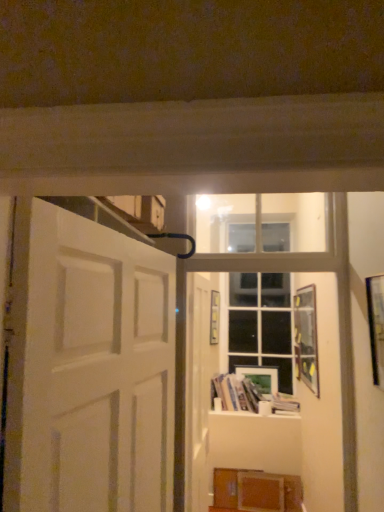
Locate an element on the screen. This screenshot has width=384, height=512. white glossy bookshelf at center, the 2th book in the right-to-left sequence is located at coordinates (246, 395).

Identify the location of white matte door at left, the 1th door when ordered from front to back. (97, 369).

Measure the distance between metallic silver picture frame at right, which ranks as the 1th picture frame in front-to-back order, and camera.

metallic silver picture frame at right, which ranks as the 1th picture frame in front-to-back order, is 5.79 feet away from camera.

You are a GUI agent. You are given a task and a screenshot of the screen. Output one action in this format:
    pyautogui.click(x=<x>, y=<y>)
    Task: Click on the metallic silver picture frame at right, which appears as the 3th picture frame when viewed from the left
    Image resolution: width=384 pixels, height=512 pixels.
    Given the screenshot: What is the action you would take?
    pyautogui.click(x=376, y=326)

The width and height of the screenshot is (384, 512). I want to click on white glossy bookshelf at center, the 1th book viewed from the left, so click(246, 395).

Which is correct: matte wooden picture frame at center, the second picture frame when ordered from left to right, is inside white glossy bookshelf at lower center, or outside of it?

The correct answer is: outside.

Considering their positions, is matte wooden picture frame at center, which ranks as the 4th picture frame in front-to-back order, located in front of or behind white glossy bookshelf at lower center?

matte wooden picture frame at center, which ranks as the 4th picture frame in front-to-back order, is behind white glossy bookshelf at lower center.

Measure the distance from matte wooden picture frame at center, which ranks as the 4th picture frame in front-to-back order, to white glossy bookshelf at lower center.

A distance of 11.84 inches exists between matte wooden picture frame at center, which ranks as the 4th picture frame in front-to-back order, and white glossy bookshelf at lower center.

Is white glossy bookshelf at lower center facing away from white matte door at left, the 2th door in the back-to-front sequence?

white glossy bookshelf at lower center is not turned away from white matte door at left, the 2th door in the back-to-front sequence.

Which object is thinner, white glossy bookshelf at lower center or white matte door at left, the 2th door in the back-to-front sequence?

white matte door at left, the 2th door in the back-to-front sequence, is thinner.

From a real-world perspective, which object rests below the other?

white glossy bookshelf at lower center, from a real-world perspective.

How many degrees apart are the facing directions of white glossy bookshelf at lower center and white matte door at left, the 1th door when ordered from front to back?

There is a 83.4-degree angle between the facing directions of white glossy bookshelf at lower center and white matte door at left, the 1th door when ordered from front to back.

From the image's perspective, is wooden picture frame at center, which ranks as the third picture frame in front-to-back order, beneath wooden picture frame at upper right, arranged as the first picture frame when viewed from the right?

No, from the image's perspective, wooden picture frame at center, which ranks as the third picture frame in front-to-back order, is not beneath wooden picture frame at upper right, arranged as the first picture frame when viewed from the right.

From a real-world perspective, who is located lower, wooden picture frame at center, positioned as the 1th picture frame in left-to-right order, or wooden picture frame at upper right, which ranks as the second picture frame in front-to-back order?

wooden picture frame at upper right, which ranks as the second picture frame in front-to-back order.

Can you see wooden picture frame at center, which ranks as the third picture frame in front-to-back order, touching wooden picture frame at upper right, the fourth picture frame in the left-to-right sequence?

No, wooden picture frame at center, which ranks as the third picture frame in front-to-back order, is not making contact with wooden picture frame at upper right, the fourth picture frame in the left-to-right sequence.

Which picture frame is the 1st one when counting from the back of the wooden picture frame at upper right, the fourth picture frame in the left-to-right sequence? Please provide its 2D coordinates.

[(214, 317)]

Looking at the image, does white matte door at center, arranged as the 2th door when viewed from the left, seem bigger or smaller compared to wooden picture frame at center, acting as the 2th picture frame starting from the back?

In the image, white matte door at center, arranged as the 2th door when viewed from the left, appears to be larger than wooden picture frame at center, acting as the 2th picture frame starting from the back.

From a real-world perspective, is white matte door at center, acting as the 1th door starting from the right, physically located above or below wooden picture frame at center, positioned as the 1th picture frame in left-to-right order?

In terms of real-world spatial position, white matte door at center, acting as the 1th door starting from the right, is below wooden picture frame at center, positioned as the 1th picture frame in left-to-right order.

Is white matte door at center, positioned as the 2th door in front-to-back order, in front of or behind wooden picture frame at center, acting as the 2th picture frame starting from the back, in the image?

white matte door at center, positioned as the 2th door in front-to-back order, is in front of wooden picture frame at center, acting as the 2th picture frame starting from the back.

Which of these two, white matte door at center, positioned as the 2th door in front-to-back order, or wooden picture frame at center, which ranks as the third picture frame in front-to-back order, stands shorter?

Standing shorter between the two is wooden picture frame at center, which ranks as the third picture frame in front-to-back order.

Considering the relative sizes of white matte door at left, the 1th door when ordered from front to back, and clear glass window at center in the image provided, is white matte door at left, the 1th door when ordered from front to back, taller than clear glass window at center?

No, white matte door at left, the 1th door when ordered from front to back, is not taller than clear glass window at center.

Between white matte door at left, placed as the 1th door when sorted from left to right, and clear glass window at center, which one has larger width?

Wider between the two is white matte door at left, placed as the 1th door when sorted from left to right.

From a real-world perspective, does white matte door at left, placed as the 1th door when sorted from left to right, sit lower than clear glass window at center?

Yes.

Looking at this image, considering the sizes of objects wooden picture frame at center, acting as the 2th picture frame starting from the back, and white glossy bookshelf at lower center in the image provided, who is taller, wooden picture frame at center, acting as the 2th picture frame starting from the back, or white glossy bookshelf at lower center?

Standing taller between the two is wooden picture frame at center, acting as the 2th picture frame starting from the back.

Is white glossy bookshelf at lower center a part of wooden picture frame at center, which is the fourth picture frame from right to left?

No, white glossy bookshelf at lower center is not a part of wooden picture frame at center, which is the fourth picture frame from right to left.

Is wooden picture frame at center, which ranks as the third picture frame in front-to-back order, at the right side of white glossy bookshelf at lower center?

No, wooden picture frame at center, which ranks as the third picture frame in front-to-back order, is not to the right of white glossy bookshelf at lower center.

Which object is more forward, wooden picture frame at center, which is the fourth picture frame from right to left, or white glossy bookshelf at lower center?

white glossy bookshelf at lower center is in front.

Which object is closer to the camera, white glossy bookshelf at center, the 1th book viewed from the left, or clear glass window at center?

white glossy bookshelf at center, the 1th book viewed from the left, is in front.

Considering the relative sizes of white glossy bookshelf at center, the 1th book viewed from the left, and clear glass window at center in the image provided, is white glossy bookshelf at center, the 1th book viewed from the left, smaller than clear glass window at center?

Indeed, white glossy bookshelf at center, the 1th book viewed from the left, has a smaller size compared to clear glass window at center.

Is white glossy bookshelf at center, the 1th book viewed from the left, shorter than clear glass window at center?

Yes, white glossy bookshelf at center, the 1th book viewed from the left, is shorter than clear glass window at center.

Is white glossy bookshelf at center, the 1th book viewed from the left, in contact with clear glass window at center?

white glossy bookshelf at center, the 1th book viewed from the left, and clear glass window at center are not in contact.

Find the location of a particular element. Image resolution: width=384 pixels, height=512 pixels. window sill in front of the matte wooden picture frame at center, the second picture frame when ordered from left to right is located at coordinates (259, 412).

This screenshot has height=512, width=384. What are the coordinates of `the 2nd door above the white glossy bookshelf at lower center (from the image's perspective)` in the screenshot? It's located at (97, 369).

From the image, which object appears to be farther from wooden picture frame at center, which is the fourth picture frame from right to left, white matte door at left, which is the 2th door from right to left, or wooden picture frame at upper right, which ranks as the second picture frame in front-to-back order?

white matte door at left, which is the 2th door from right to left, is further to wooden picture frame at center, which is the fourth picture frame from right to left.

Based on their spatial positions, is clear glass window at center or metallic silver picture frame at right, which ranks as the 1th picture frame in front-to-back order, closer to wooden picture frame at center, which is the fourth picture frame from right to left?

clear glass window at center is closer to wooden picture frame at center, which is the fourth picture frame from right to left.

When comparing their distances from white glossy bookshelf at center, the 2th book in the right-to-left sequence, does wooden cabinet at lower right or clear glass window at center seem further?

wooden cabinet at lower right is further to white glossy bookshelf at center, the 2th book in the right-to-left sequence.

Which object lies further to the anchor point wooden cabinet at lower right, white glossy bookshelf at lower center or clear glass window at center?

Among the two, clear glass window at center is located further to wooden cabinet at lower right.

Estimate the real-world distances between objects in this image. Which object is closer to metallic silver picture frame at right, which appears as the 3th picture frame when viewed from the left, white matte door at left, which is the 2th door from right to left, or white glossy bookshelf at lower center?

The object closer to metallic silver picture frame at right, which appears as the 3th picture frame when viewed from the left, is white matte door at left, which is the 2th door from right to left.

When comparing their distances from metallic silver picture frame at right, the fourth picture frame viewed from the back, does white glossy bookshelf at center, the 2th book in the right-to-left sequence, or clear glass window at center seem further?

Among the two, clear glass window at center is located further to metallic silver picture frame at right, the fourth picture frame viewed from the back.

Estimate the real-world distances between objects in this image. Which object is closer to wooden picture frame at center, which ranks as the third picture frame in front-to-back order, metallic silver picture frame at right, which ranks as the 1th picture frame in front-to-back order, or matte wooden picture frame at center, which ranks as the 4th picture frame in front-to-back order?

The object closer to wooden picture frame at center, which ranks as the third picture frame in front-to-back order, is matte wooden picture frame at center, which ranks as the 4th picture frame in front-to-back order.

Based on their spatial positions, is white matte door at left, placed as the 1th door when sorted from left to right, or metallic silver picture frame at right, which appears as the 3th picture frame when viewed from the left, closer to white glossy bookshelf at center, the 1th book viewed from the left?

metallic silver picture frame at right, which appears as the 3th picture frame when viewed from the left, is positioned closer to the anchor white glossy bookshelf at center, the 1th book viewed from the left.

Identify the location of book located between metallic silver picture frame at right, which appears as the 3th picture frame when viewed from the left, and white glossy bookshelf at center, the 1th book viewed from the left, in the depth direction. This screenshot has height=512, width=384. (283, 404).

This screenshot has width=384, height=512. I want to click on window sill located between wooden picture frame at upper right, arranged as the first picture frame when viewed from the right, and hardcover book at center, which is the 1th book from right to left, in the depth direction, so click(x=259, y=412).

The width and height of the screenshot is (384, 512). Identify the location of cabinet between metallic silver picture frame at right, which ranks as the 1th picture frame in front-to-back order, and clear glass window at center in the front-back direction. (257, 490).

This screenshot has height=512, width=384. In order to click on door between metallic silver picture frame at right, which ranks as the 1th picture frame in front-to-back order, and hardcover book at center, the 2th book in the left-to-right sequence, from front to back in this screenshot , I will do `click(198, 391)`.